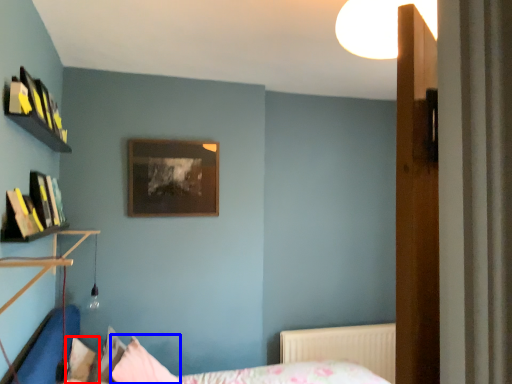
Question: Which object is further to the camera taking this photo, pillow (highlighted by a red box) or pillow (highlighted by a blue box)?

Choices:
 (A) pillow
 (B) pillow

Answer: (A)